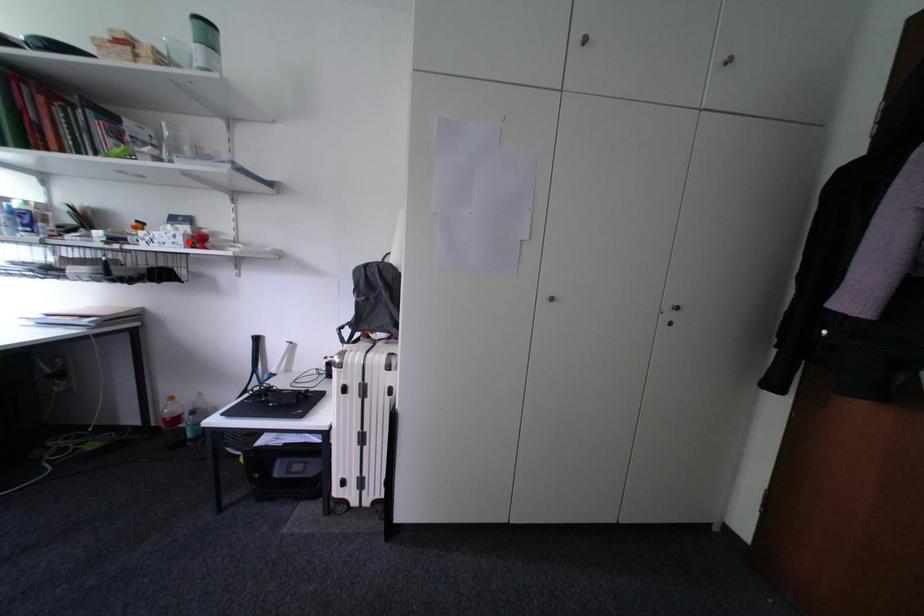
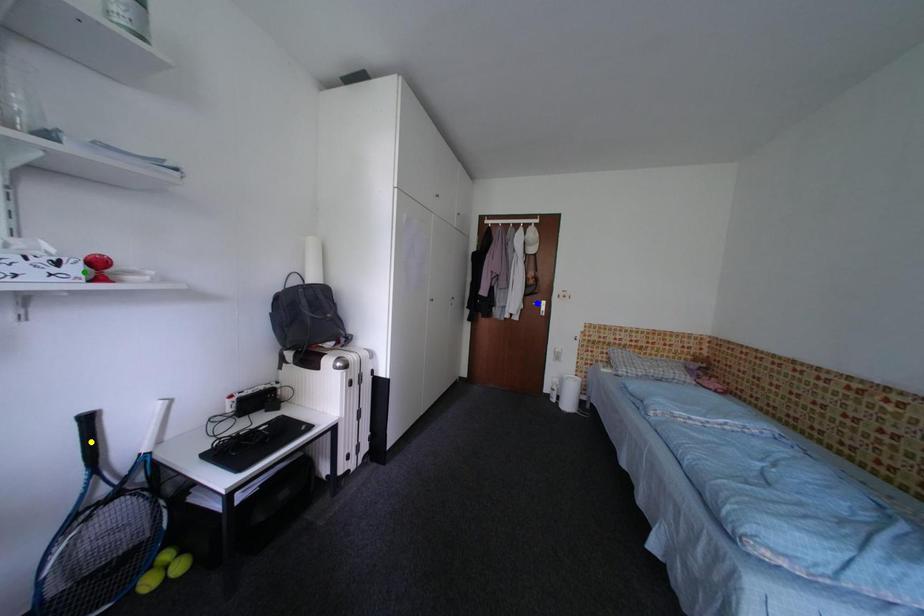
Question: I am providing you with two images of the same scene from different viewpoints. A red point is marked on the first image. You are given multiple points on the second image. Which mark in image 2 goes with the point in image 1?

Choices:
 (A) yellow point
 (B) green point
 (C) blue point

Answer: (B)